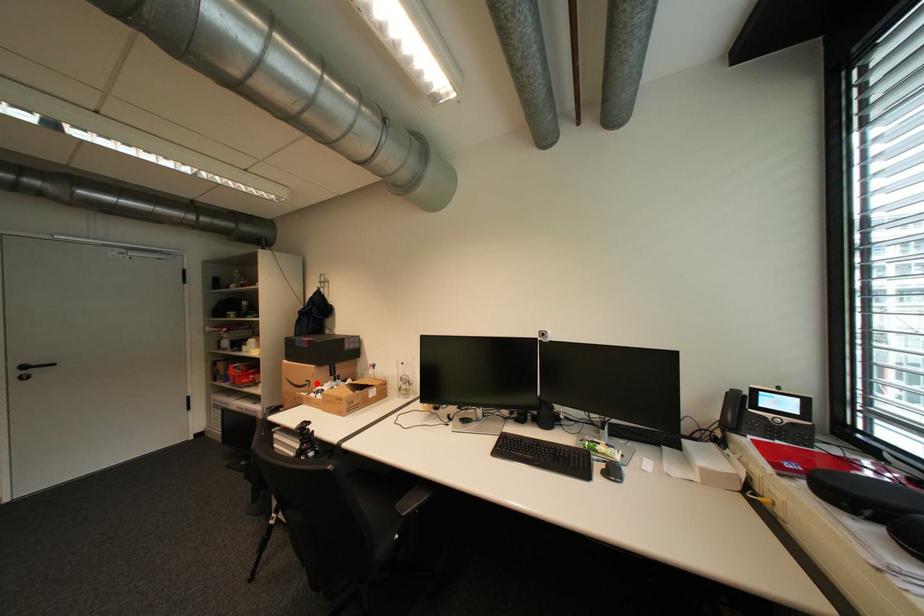
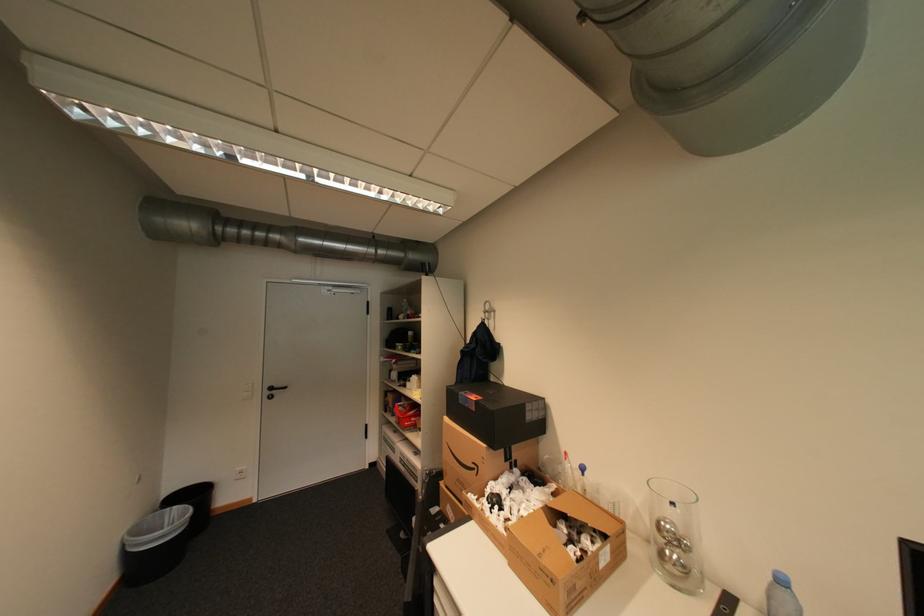
In the second image, find the point that corresponds to the highlighted location in the first image.

(484, 468)